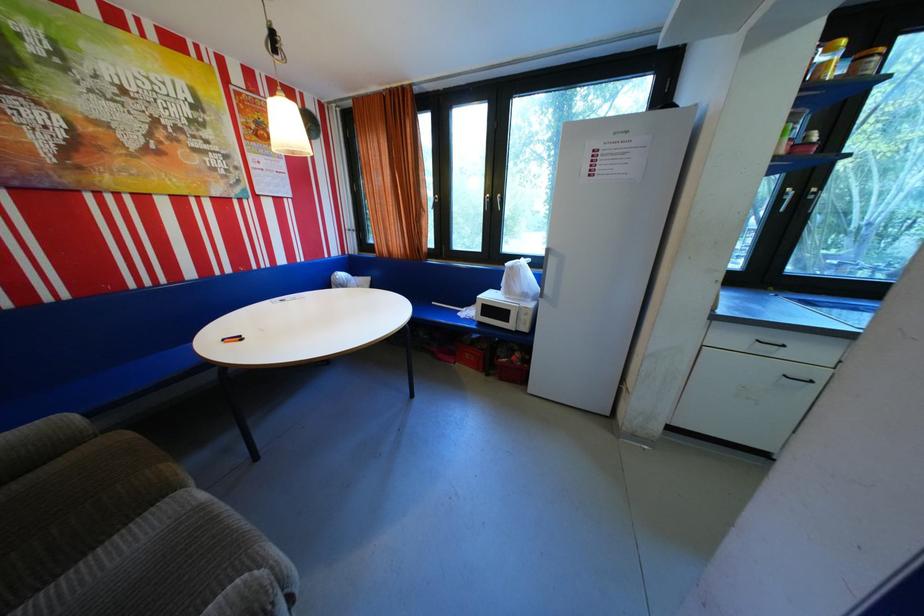
What do you see at coordinates (101, 386) in the screenshot? The width and height of the screenshot is (924, 616). I see `the blue sofa sitting surface` at bounding box center [101, 386].